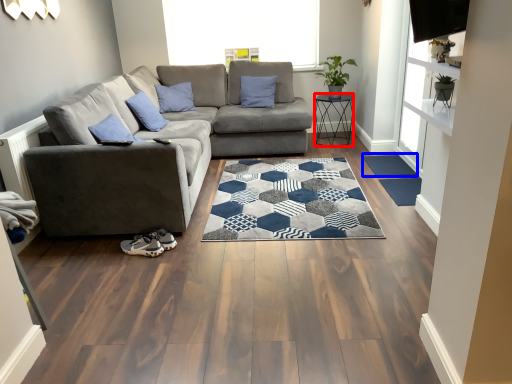
Question: Which object appears closest to the camera in this image, furniture (highlighted by a red box) or doormat (highlighted by a blue box)?

Choices:
 (A) furniture
 (B) doormat

Answer: (B)